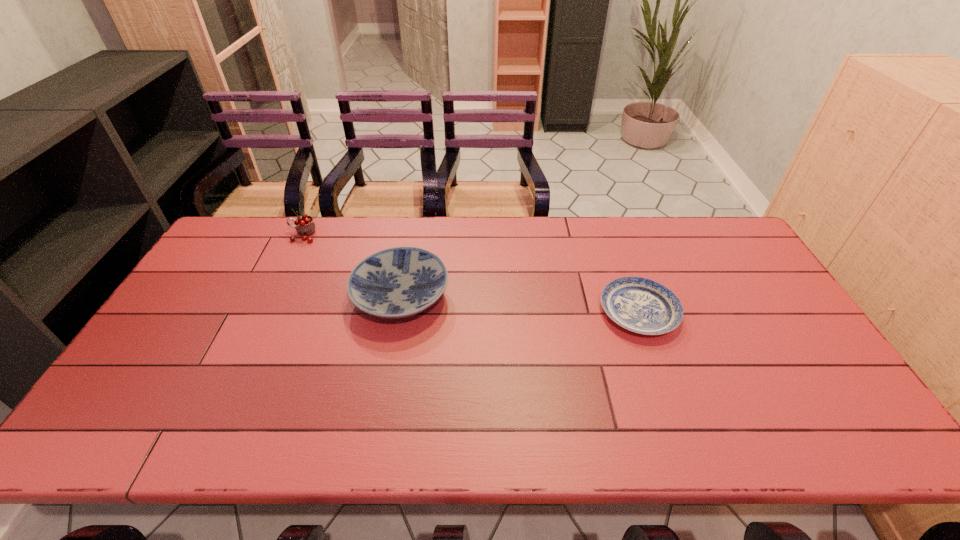
The width and height of the screenshot is (960, 540). Find the location of `the leftmost object`. the leftmost object is located at coordinates (305, 226).

Locate an element on the screen. The image size is (960, 540). cherry is located at coordinates (305, 226).

I want to click on the taller plate, so click(399, 282).

The height and width of the screenshot is (540, 960). Identify the location of the second shortest object. (399, 282).

Identify the location of the shortest object. Image resolution: width=960 pixels, height=540 pixels. (640, 305).

Find the location of a particular element. Image resolution: width=960 pixels, height=540 pixels. the right plate is located at coordinates (640, 305).

Identify the location of free space located on the handle side of the leftmost object. This screenshot has height=540, width=960. (249, 235).

Locate an element on the screen. blank space located on the handle side of the leftmost object is located at coordinates (234, 235).

Identify the location of blank space located 0.130m on the handle side of the leftmost object. [252, 235].

Identify the location of blank space located 0.220m on the front of the taller plate. This screenshot has height=540, width=960. (381, 406).